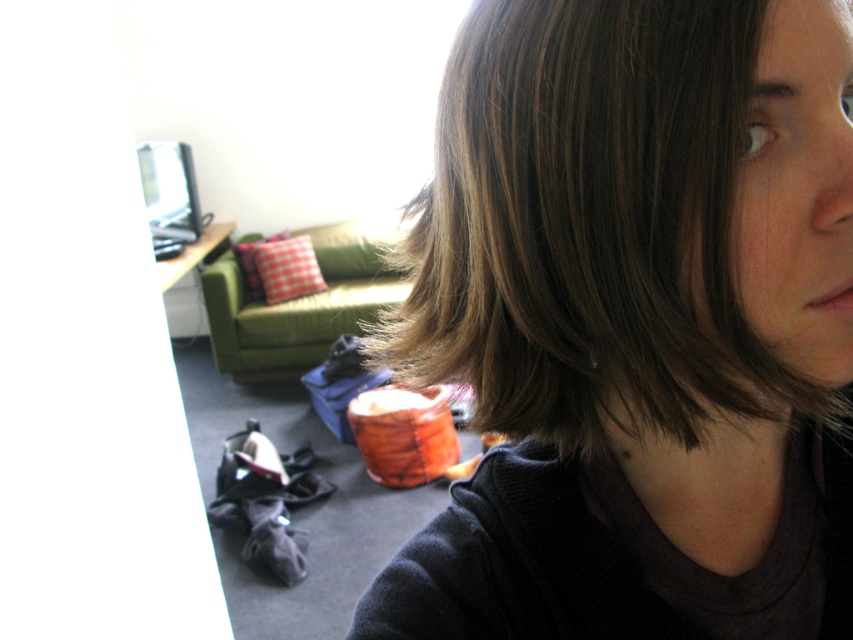
Question: Which point is closer to the camera?

Choices:
 (A) (604, 332)
 (B) (323, 352)

Answer: (A)

Question: Does brown hair at center appear on the left side of green fabric armchair at center?

Choices:
 (A) yes
 (B) no

Answer: (B)

Question: Can you confirm if brown hair at center is positioned above green fabric armchair at center?

Choices:
 (A) yes
 (B) no

Answer: (B)

Question: Can you confirm if brown hair at center is thinner than green fabric armchair at center?

Choices:
 (A) no
 (B) yes

Answer: (B)

Question: Which point is farther from the camera taking this photo?

Choices:
 (A) (390, 273)
 (B) (471, 502)

Answer: (A)